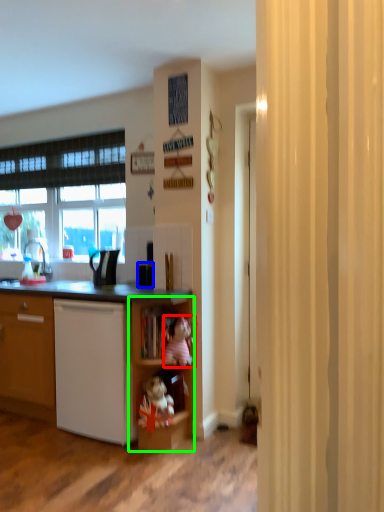
Question: Which object is the closest to the toy (highlighted by a red box)? Choose among these: appliance (highlighted by a blue box) or shelf (highlighted by a green box).

Choices:
 (A) appliance
 (B) shelf

Answer: (B)